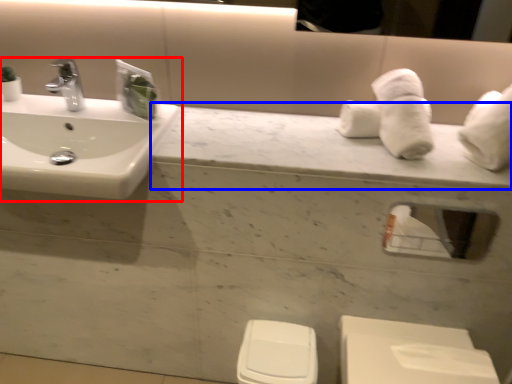
Question: Which of the following is the closest to the observer, sink (highlighted by a red box) or counter top (highlighted by a blue box)?

Choices:
 (A) sink
 (B) counter top

Answer: (A)